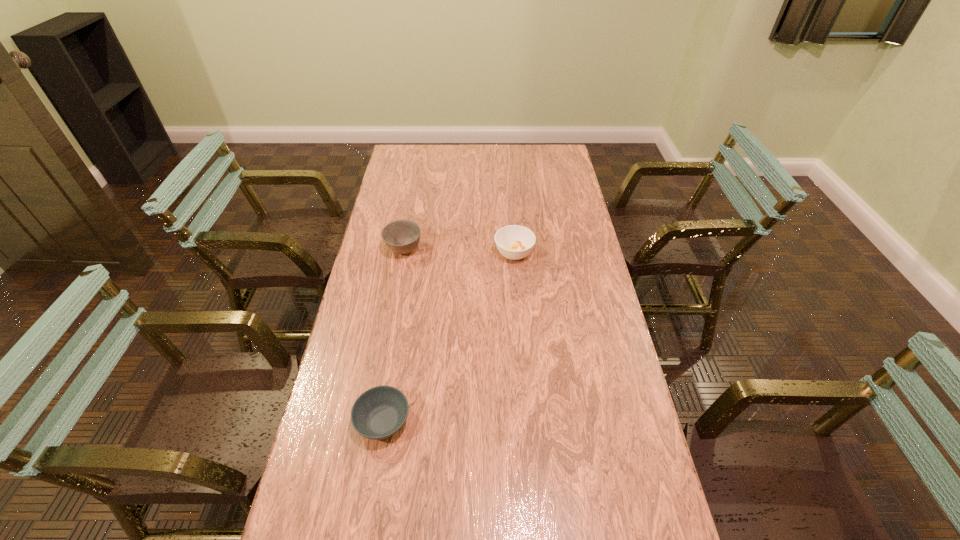
Locate an element on the screen. This screenshot has width=960, height=540. bowl is located at coordinates (401, 236).

Find the location of a particular element. The height and width of the screenshot is (540, 960). the taller soup bowl is located at coordinates (514, 242).

Locate an element on the screen. the farther soup bowl is located at coordinates (514, 242).

Where is `the left soup bowl`? the left soup bowl is located at coordinates (378, 413).

Locate an element on the screen. The image size is (960, 540). the nearer soup bowl is located at coordinates (378, 413).

You are a GUI agent. You are given a task and a screenshot of the screen. Output one action in this format:
    pyautogui.click(x=<x>, y=<y>)
    Task: Click on the vacant space located 0.110m on the back of the bowl
    Image resolution: width=960 pixels, height=540 pixels.
    Given the screenshot: What is the action you would take?
    pyautogui.click(x=409, y=219)

You are a GUI agent. You are given a task and a screenshot of the screen. Output one action in this format:
    pyautogui.click(x=<x>, y=<y>)
    Task: Click on the free location located on the front of the right soup bowl
    
    Given the screenshot: What is the action you would take?
    pyautogui.click(x=517, y=300)

Find the location of a particular element. This screenshot has width=960, height=540. vacant area situated on the back of the nearest object is located at coordinates tap(402, 303).

Identify the location of bowl present at the left edge. (401, 236).

Identify the location of soup bowl located in the left edge section of the desktop. (378, 413).